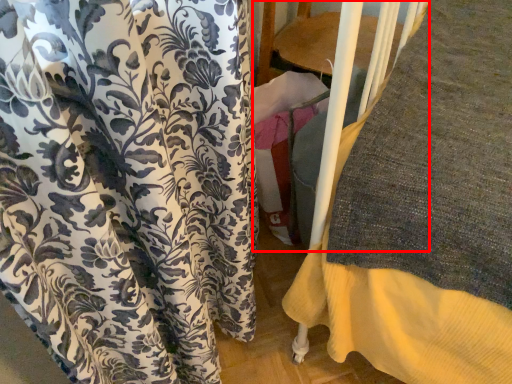
Question: From the image's perspective, what is the correct spatial positioning of bunk bed (annotated by the red box) in reference to curtain?

Choices:
 (A) below
 (B) above

Answer: (B)